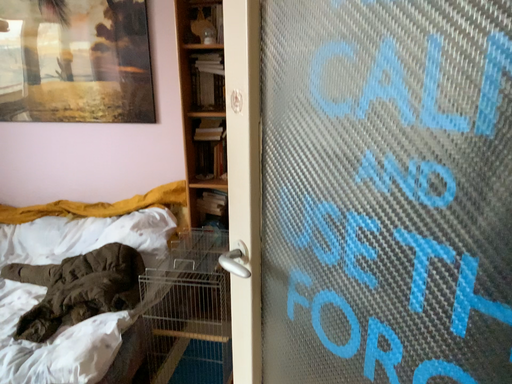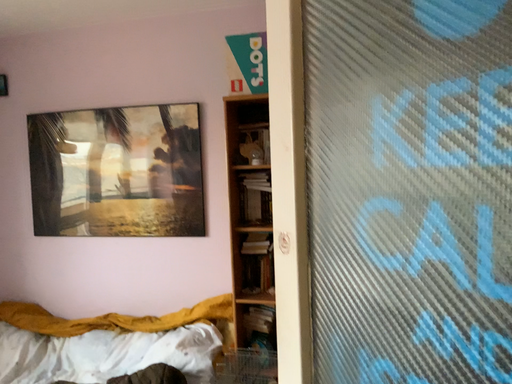
Question: Which way did the camera rotate in the video?

Choices:
 (A) rotated downward
 (B) rotated upward

Answer: (B)